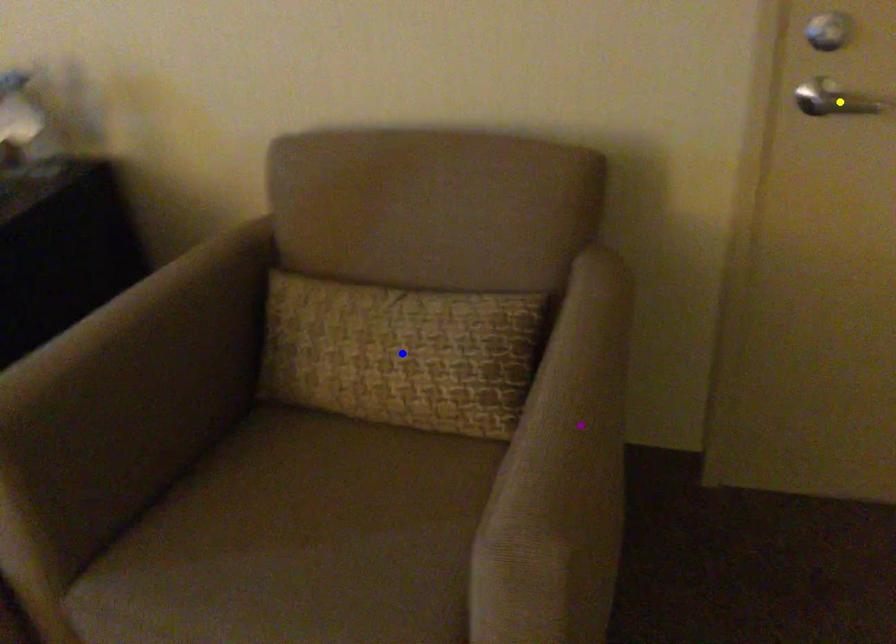
Order these from nearest to farthest:
1. yellow point
2. blue point
3. purple point

purple point < yellow point < blue point